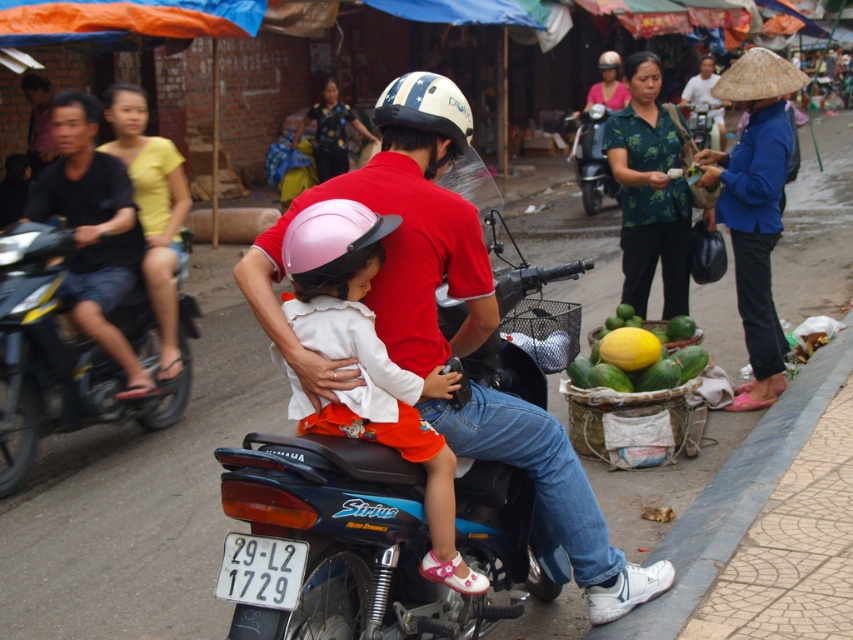
Question: Which point is farther to the camera?

Choices:
 (A) yellow cotton shirt at upper left
 (B) blue fabric hat at upper right
 (C) white plastic license plate at lower center

Answer: (B)

Question: Which point is closer to the camera taking this photo?

Choices:
 (A) (163, 212)
 (B) (720, 214)
 (C) (131, 275)
 (D) (294, 572)

Answer: (D)

Question: Can you confirm if dark blue jeans at left is smaller than metallic silver motorcycle at center?

Choices:
 (A) yes
 (B) no

Answer: (A)

Question: Can you confirm if matte pink helmet at center is positioned to the left of metallic silver motorcycle at center?

Choices:
 (A) no
 (B) yes

Answer: (B)

Question: Which of these objects is positioned closest to the blue fabric hat at right?

Choices:
 (A) dark blue jeans at left
 (B) matte black helmet at upper center
 (C) white plastic license plate at lower center

Answer: (A)

Question: Does white plastic license plate at lower center have a lesser width compared to pink matte helmet at center?

Choices:
 (A) yes
 (B) no

Answer: (A)